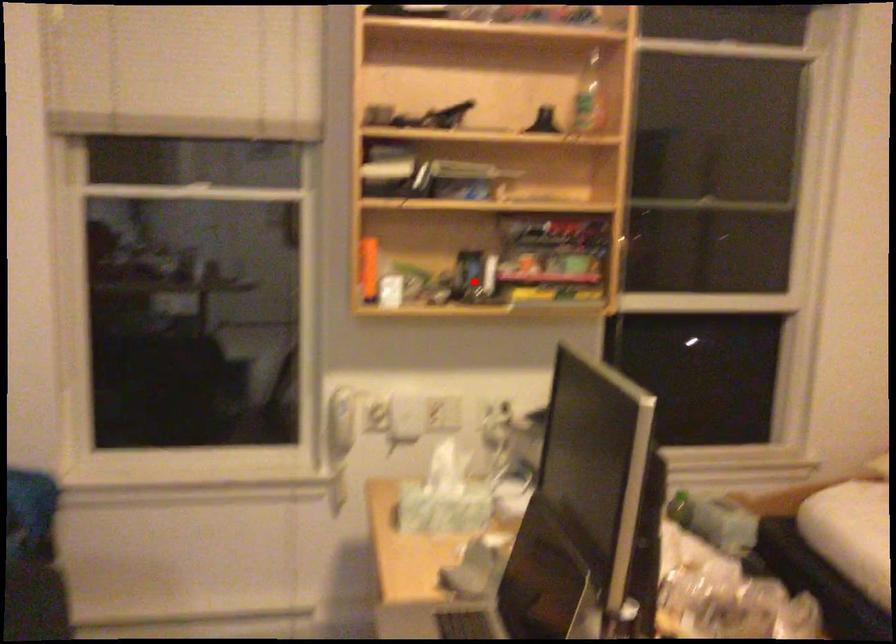
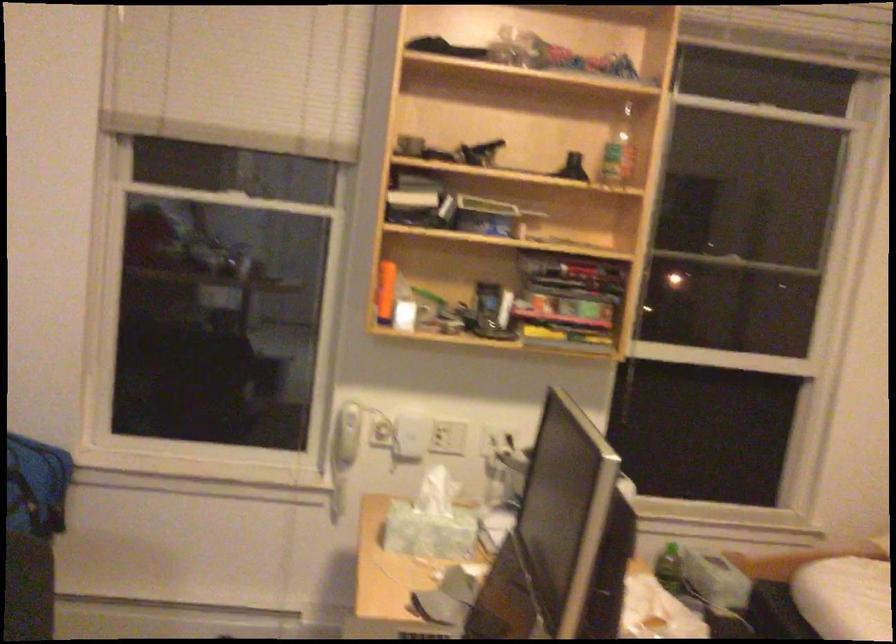
Find the pixel in the second image that matches the highlighted location in the first image.

(489, 313)